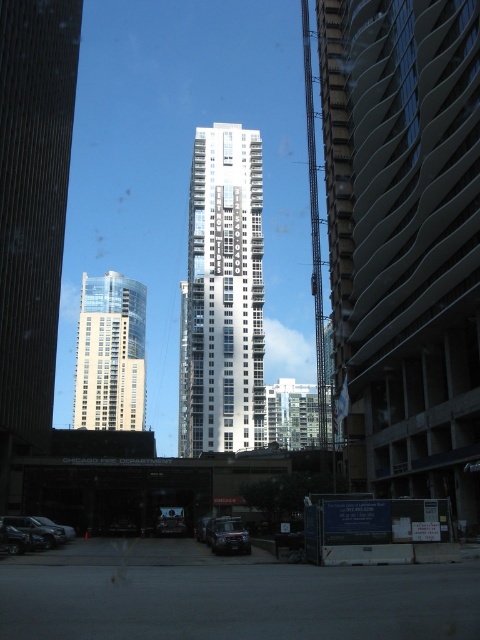
You are an architect analyzing the urban skyline. Given the smooth concrete building at center and the clear glass tower at center, which one has a greater height?

The smooth concrete building at center is taller than the clear glass tower at center according to the description provided.